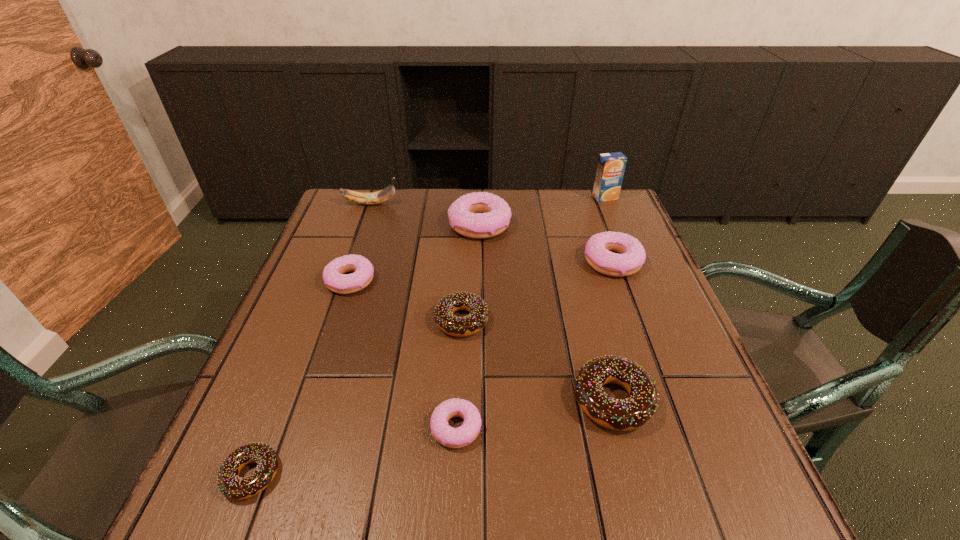
What are the coordinates of `vacant area located on the back of the second smallest purple doughnut` in the screenshot? It's located at (369, 227).

The width and height of the screenshot is (960, 540). What are the coordinates of `vacant point located on the left of the second chocolate doughnut from left to right` in the screenshot? It's located at (281, 320).

I want to click on free region located on the right of the nearest purple doughnut, so click(x=526, y=427).

In order to click on free space located 0.240m on the back of the leftmost chocolate doughnut in this screenshot , I will do `click(303, 341)`.

In order to click on orange_juice that is positioned at the far edge in this screenshot , I will do `click(611, 166)`.

Where is `banana situated at the far edge`? banana situated at the far edge is located at coordinates (385, 194).

This screenshot has width=960, height=540. In order to click on doughnut at the far edge in this screenshot , I will do `click(479, 215)`.

Locate an element on the screen. object positioned at the near edge is located at coordinates (232, 486).

This screenshot has width=960, height=540. Identify the location of banana positioned at the left edge. (385, 194).

In order to click on orange_juice that is at the right edge in this screenshot , I will do `click(611, 166)`.